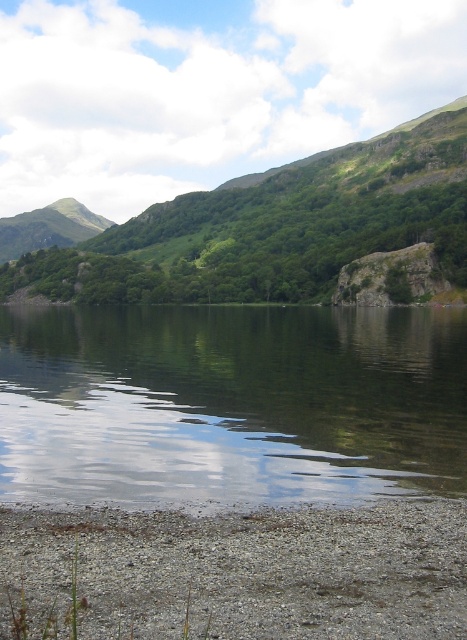
You are standing at the point marked as point (231,403) in the image. What is the nearest object to you?

The transparent water at center is located at point (231,403), so you are standing in the transparent water at center.